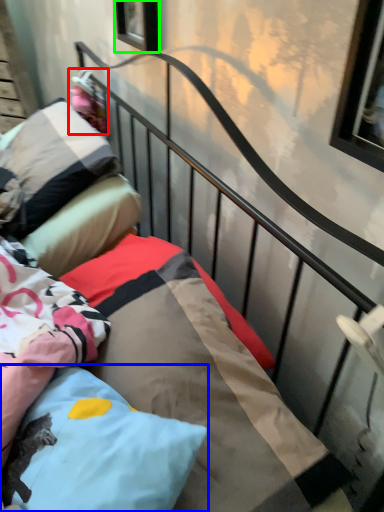
Question: Considering the real-world distances, which object is closest to doll (highlighted by a red box)? pillow (highlighted by a blue box) or window (highlighted by a green box).

Choices:
 (A) pillow
 (B) window

Answer: (B)